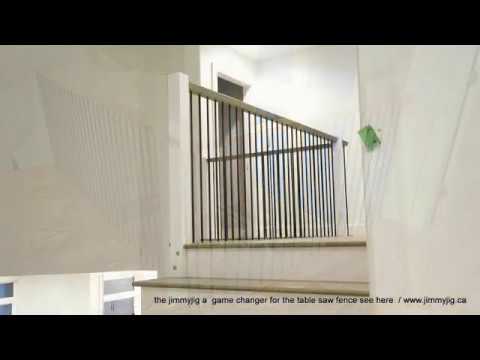
Locate an element on the screen. This screenshot has height=360, width=480. supporting pillar for staircase is located at coordinates (175, 109), (340, 175).